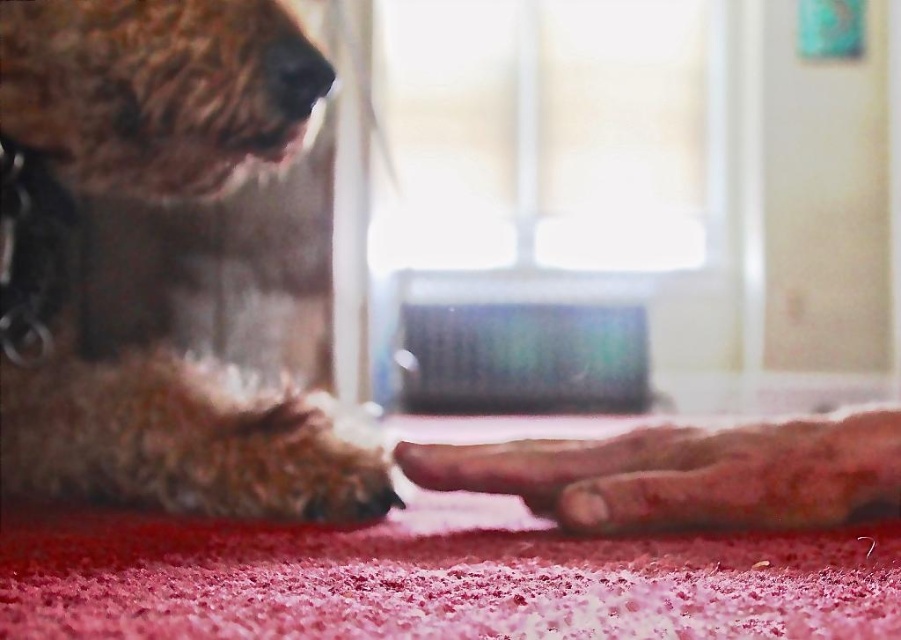
You are a dog trainer observing the interaction between the fuzzy brown dog at left and the fuzzy fur paw at lower center. Which object is taller?

The fuzzy brown dog at left is much taller than the fuzzy fur paw at lower center.

You are a photographer trying to capture a close shot of the fuzzy fur paw at lower center without the fuzzy brown dog at left blocking the view. Can you move the dog to the right to get a clear shot?

The fuzzy brown dog at left is positioned on the left side of the fuzzy fur paw at lower center, so moving the dog to the right would place it away from the paw, allowing for a clear shot.

You are standing in a room with a red carpet and a window with white frames. You see a point marked at coordinates (142, 106). Based on the scene description, what object is located at this point?

The point at coordinates (142, 106) corresponds to the fuzzy brown dog at left.